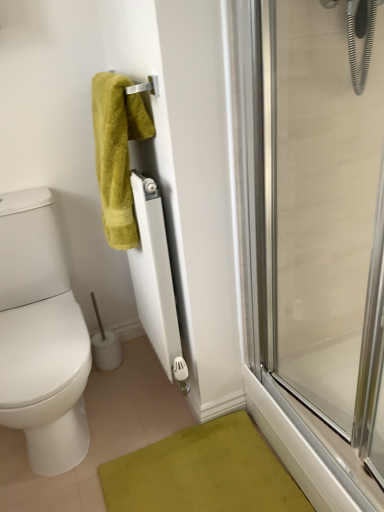
Question: Is the depth of white matte radiator at center greater than that of transparent glass shower door at right?

Choices:
 (A) yes
 (B) no

Answer: (A)

Question: Does white matte radiator at center have a smaller size compared to transparent glass shower door at right?

Choices:
 (A) no
 (B) yes

Answer: (A)

Question: From a real-world perspective, is white matte radiator at center on transparent glass shower door at right?

Choices:
 (A) no
 (B) yes

Answer: (A)

Question: From a real-world perspective, is white matte radiator at center positioned under transparent glass shower door at right based on gravity?

Choices:
 (A) yes
 (B) no

Answer: (A)

Question: From the image's perspective, is white matte radiator at center on transparent glass shower door at right?

Choices:
 (A) yes
 (B) no

Answer: (B)

Question: Considering the positions of point (142, 129) and point (284, 354), is point (142, 129) closer or farther from the camera than point (284, 354)?

Choices:
 (A) closer
 (B) farther

Answer: (A)

Question: In terms of height, does green fuzzy towel at upper left look taller or shorter compared to transparent glass shower door at right?

Choices:
 (A) short
 (B) tall

Answer: (A)

Question: Considering their positions, is green fuzzy towel at upper left located in front of or behind transparent glass shower door at right?

Choices:
 (A) behind
 (B) front

Answer: (A)

Question: From the image's perspective, is green fuzzy towel at upper left located above or below transparent glass shower door at right?

Choices:
 (A) below
 (B) above

Answer: (B)

Question: From the image's perspective, relative to white matte radiator at center, is green fuzzy towel at upper left above or below?

Choices:
 (A) above
 (B) below

Answer: (A)

Question: In the image, is green fuzzy towel at upper left positioned in front of or behind white matte radiator at center?

Choices:
 (A) front
 (B) behind

Answer: (A)

Question: In terms of height, does green fuzzy towel at upper left look taller or shorter compared to white matte radiator at center?

Choices:
 (A) short
 (B) tall

Answer: (A)

Question: In terms of size, does green fuzzy towel at upper left appear bigger or smaller than white matte radiator at center?

Choices:
 (A) small
 (B) big

Answer: (A)

Question: Is white matte radiator at center inside or outside of green fuzzy towel at upper left?

Choices:
 (A) inside
 (B) outside

Answer: (B)

Question: Based on their sizes in the image, would you say white matte radiator at center is bigger or smaller than green fuzzy towel at upper left?

Choices:
 (A) big
 (B) small

Answer: (A)